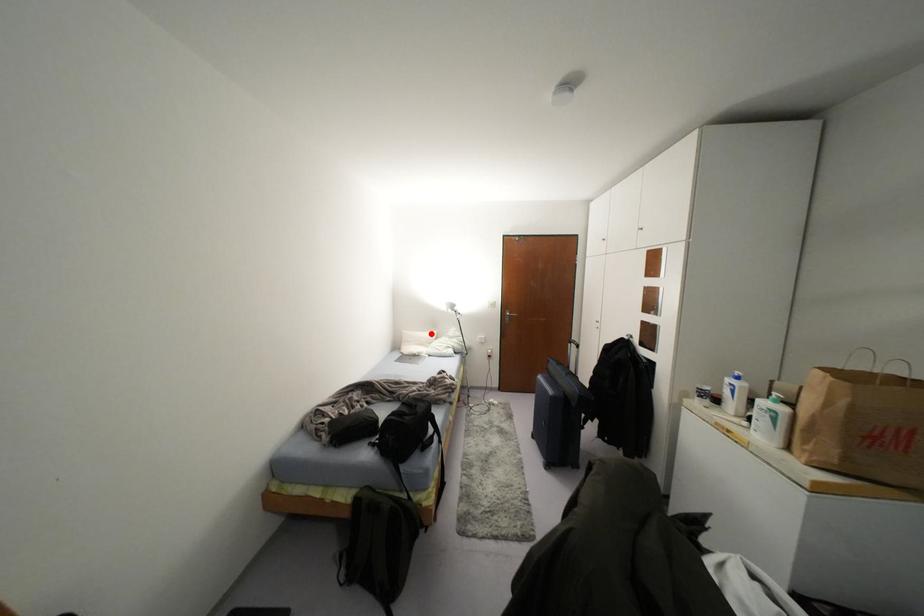
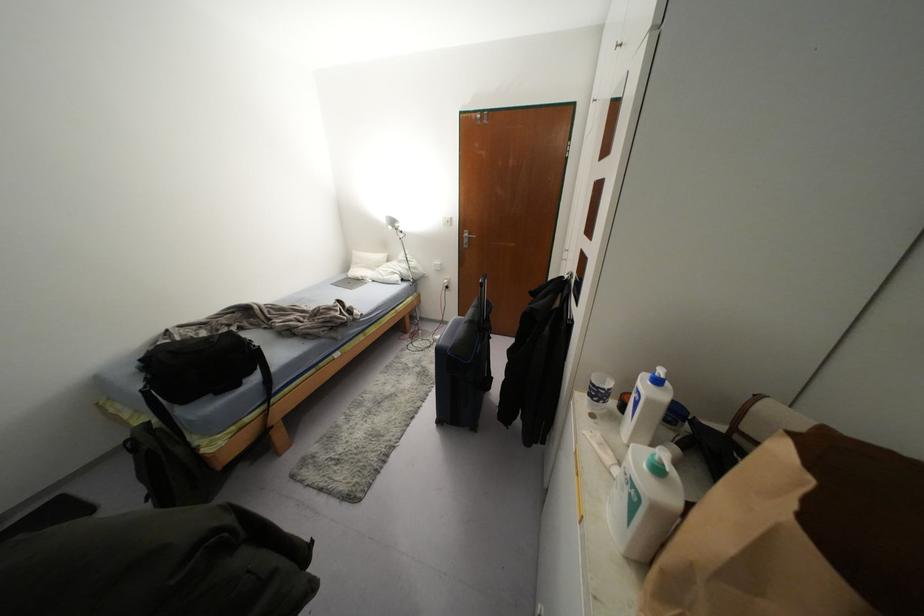
The point at the highlighted location is marked in the first image. Where is the corresponding point in the second image?

(382, 256)